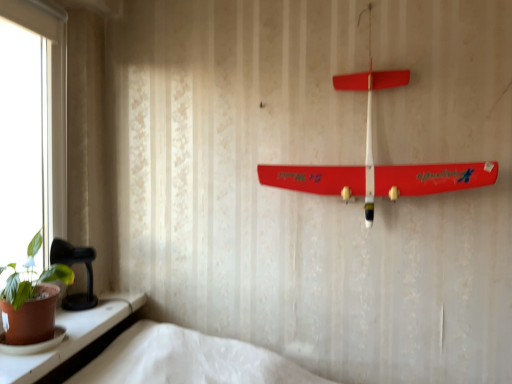
Question: Is green matte houseplant at lower left shorter than matte white window sill at lower left?

Choices:
 (A) yes
 (B) no

Answer: (B)

Question: Does green matte houseplant at lower left turn towards matte white window sill at lower left?

Choices:
 (A) no
 (B) yes

Answer: (A)

Question: Can you confirm if green matte houseplant at lower left is smaller than matte white window sill at lower left?

Choices:
 (A) no
 (B) yes

Answer: (A)

Question: Is green matte houseplant at lower left closer to the viewer compared to matte white window sill at lower left?

Choices:
 (A) yes
 (B) no

Answer: (B)

Question: Does green matte houseplant at lower left have a greater width compared to matte white window sill at lower left?

Choices:
 (A) yes
 (B) no

Answer: (B)

Question: Is green matte houseplant at lower left bigger or smaller than matte white window sill at lower left?

Choices:
 (A) big
 (B) small

Answer: (A)

Question: Is green matte houseplant at lower left wider or thinner than matte white window sill at lower left?

Choices:
 (A) thin
 (B) wide

Answer: (A)

Question: In terms of height, does green matte houseplant at lower left look taller or shorter compared to matte white window sill at lower left?

Choices:
 (A) tall
 (B) short

Answer: (A)

Question: From the image's perspective, relative to matte white window sill at lower left, is green matte houseplant at lower left above or below?

Choices:
 (A) below
 (B) above

Answer: (B)

Question: Based on their positions, is matte white window sill at lower left located to the left or right of smooth plastic airplane at upper center?

Choices:
 (A) right
 (B) left

Answer: (B)

Question: Looking at their shapes, would you say matte white window sill at lower left is wider or thinner than smooth plastic airplane at upper center?

Choices:
 (A) thin
 (B) wide

Answer: (B)

Question: Is matte white window sill at lower left in front of or behind smooth plastic airplane at upper center in the image?

Choices:
 (A) front
 (B) behind

Answer: (A)

Question: Considering the positions of matte white window sill at lower left and smooth plastic airplane at upper center in the image, is matte white window sill at lower left bigger or smaller than smooth plastic airplane at upper center?

Choices:
 (A) small
 (B) big

Answer: (A)

Question: From the image's perspective, is smooth plastic airplane at upper center located above or below green matte houseplant at lower left?

Choices:
 (A) above
 (B) below

Answer: (A)

Question: Would you say smooth plastic airplane at upper center is to the left or to the right of green matte houseplant at lower left in the picture?

Choices:
 (A) left
 (B) right

Answer: (B)